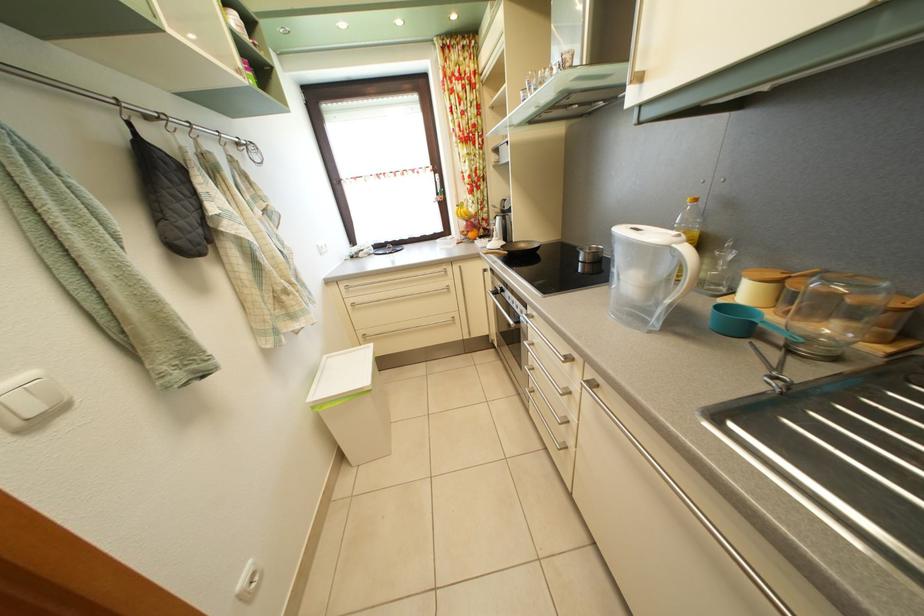
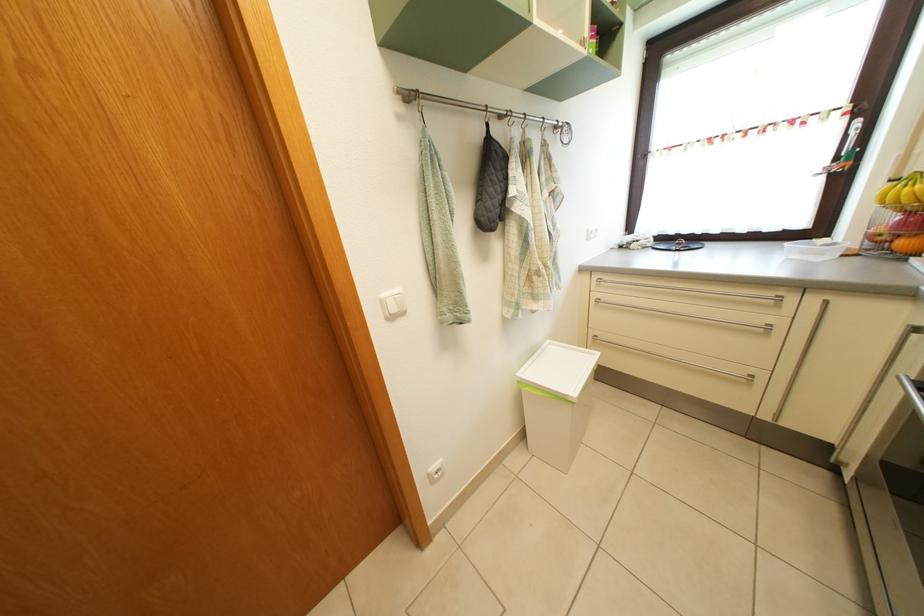
Locate, in the second image, the point that corresponds to [479,243] in the first image.

(910, 252)